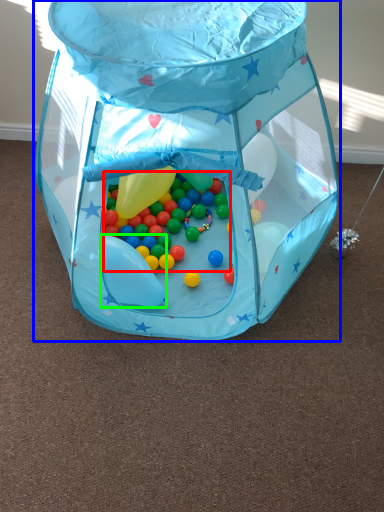
Question: Considering the real-world distances, which object is farthest from candy (highlighted by a red box)? toy (highlighted by a blue box) or balloon (highlighted by a green box)?

Choices:
 (A) toy
 (B) balloon

Answer: (A)